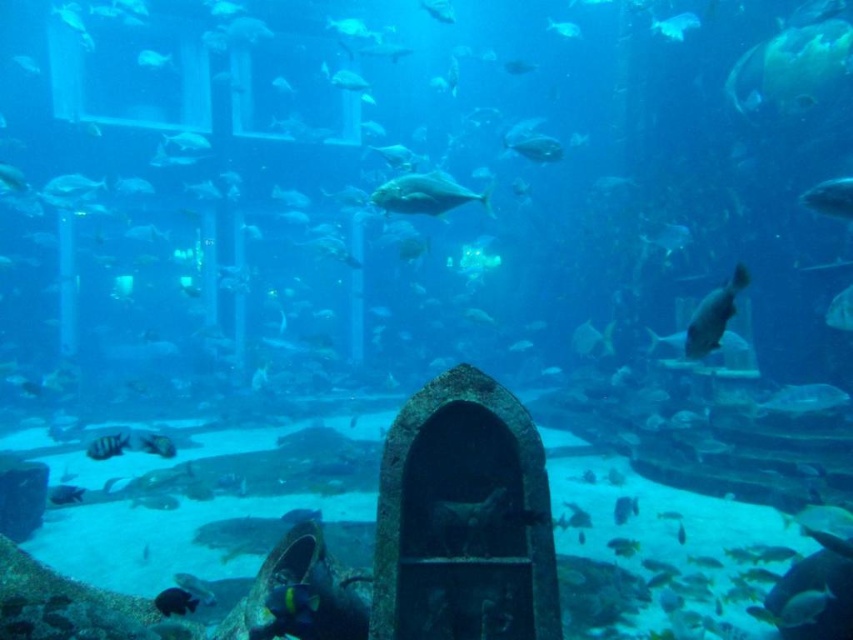
Question: Estimate the real-world distances between objects in this image. Which object is farther from the shiny silver fish at right?

Choices:
 (A) shiny silver fish at center
 (B) translucent blue fish at upper right
 (C) shiny black fish at lower left
 (D) shiny silver fish at upper right

Answer: (D)

Question: Considering the real-world distances, which object is farthest from the translucent blue fish at upper right?

Choices:
 (A) shiny silver fish at upper right
 (B) shiny black fish at lower left

Answer: (A)

Question: In this image, where is shiny silver fish at upper right located relative to shiny silver fish at right?

Choices:
 (A) left
 (B) right

Answer: (B)

Question: From the image, what is the correct spatial relationship of shiny silver fish at center in relation to translucent blue fish at upper right?

Choices:
 (A) left
 (B) right

Answer: (A)

Question: Can you confirm if shiny silver fish at right is positioned above shiny black fish at lower left?

Choices:
 (A) no
 (B) yes

Answer: (B)

Question: Estimate the real-world distances between objects in this image. Which object is farther from the translucent blue fish at upper right?

Choices:
 (A) shiny silver fish at right
 (B) shiny black fish at lower left

Answer: (B)